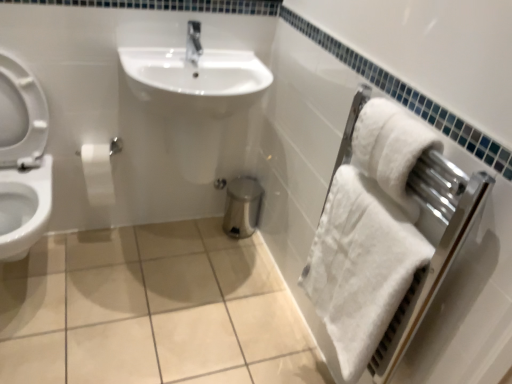
In order to click on blank area beneath white glossy toilet at left (from a real-world perspective) in this screenshot , I will do pyautogui.click(x=31, y=270).